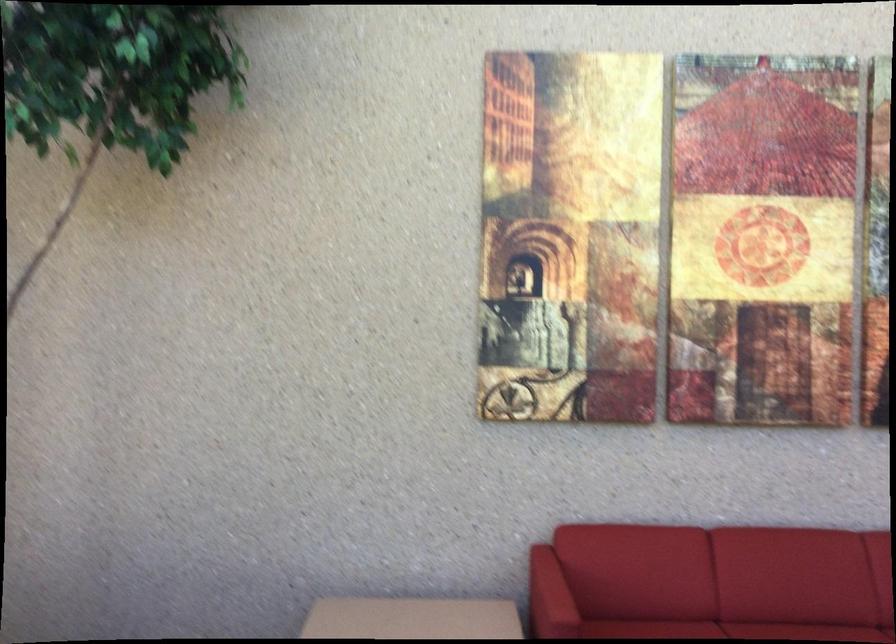
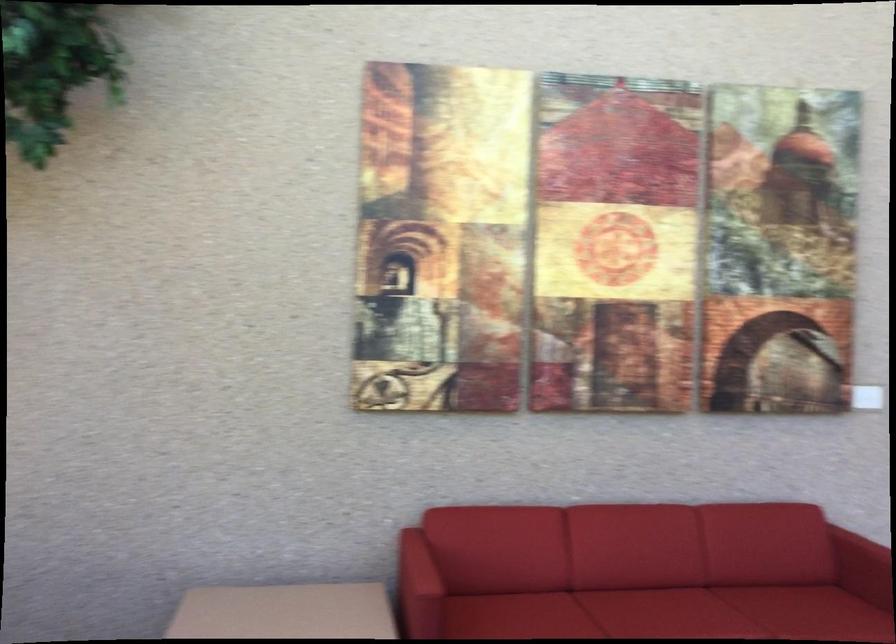
Question: The images are taken continuously from a first-person perspective. In which direction are you moving?

Choices:
 (A) Left
 (B) Right
 (C) Forward
 (D) Backward

Answer: (D)